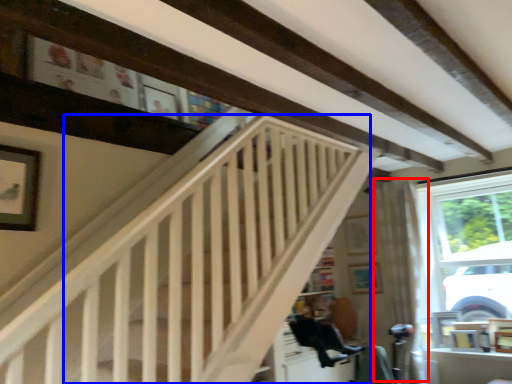
Question: Which object is closer to the camera taking this photo, curtain (highlighted by a red box) or stairwell (highlighted by a blue box)?

Choices:
 (A) curtain
 (B) stairwell

Answer: (B)